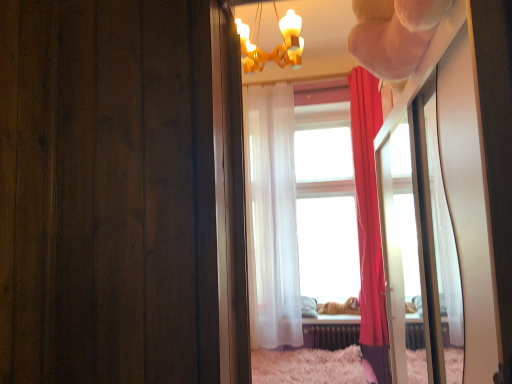
Question: Does golden fur dog at center appear on the left side of gold textured chandelier at upper center?

Choices:
 (A) no
 (B) yes

Answer: (A)

Question: Can you confirm if golden fur dog at center is shorter than gold textured chandelier at upper center?

Choices:
 (A) yes
 (B) no

Answer: (A)

Question: Considering the relative positions of golden fur dog at center and gold textured chandelier at upper center in the image provided, is golden fur dog at center behind gold textured chandelier at upper center?

Choices:
 (A) no
 (B) yes

Answer: (B)

Question: From the image's perspective, is golden fur dog at center below gold textured chandelier at upper center?

Choices:
 (A) yes
 (B) no

Answer: (A)

Question: Is golden fur dog at center beside gold textured chandelier at upper center?

Choices:
 (A) no
 (B) yes

Answer: (A)

Question: From the image's perspective, would you say golden fur dog at center is positioned over gold textured chandelier at upper center?

Choices:
 (A) no
 (B) yes

Answer: (A)

Question: Are silky red curtain at right, which is the second curtain from left to right, and metallic radiator at lower center beside each other?

Choices:
 (A) no
 (B) yes

Answer: (A)

Question: Does silky red curtain at right, which is the first curtain from right to left, appear on the right side of metallic radiator at lower center?

Choices:
 (A) no
 (B) yes

Answer: (B)

Question: Is silky red curtain at right, which is the second curtain from left to right, positioned behind metallic radiator at lower center?

Choices:
 (A) no
 (B) yes

Answer: (A)

Question: Does silky red curtain at right, which is the first curtain from right to left, have a greater width compared to metallic radiator at lower center?

Choices:
 (A) no
 (B) yes

Answer: (B)

Question: Considering the relative positions of silky red curtain at right, which is the first curtain from right to left, and metallic radiator at lower center in the image provided, is silky red curtain at right, which is the first curtain from right to left, in front of metallic radiator at lower center?

Choices:
 (A) yes
 (B) no

Answer: (A)

Question: From a real-world perspective, is silky red curtain at right, which is the first curtain from right to left, positioned under metallic radiator at lower center based on gravity?

Choices:
 (A) yes
 (B) no

Answer: (B)

Question: Considering the relative positions of golden fur dog at center and metallic radiator at lower center in the image provided, is golden fur dog at center to the left of metallic radiator at lower center from the viewer's perspective?

Choices:
 (A) yes
 (B) no

Answer: (B)